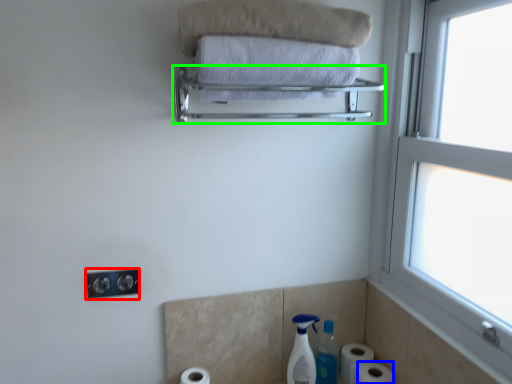
Question: Based on their relative distances, which object is farther from electric outlet (highlighted by a red box)? Choose from toilet paper (highlighted by a blue box) and balustrade (highlighted by a green box).

Choices:
 (A) toilet paper
 (B) balustrade

Answer: (A)